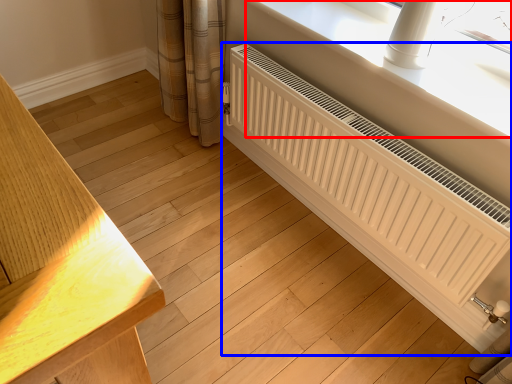
Question: Among these objects, which one is farthest to the camera, window sill (highlighted by a red box) or radiator (highlighted by a blue box)?

Choices:
 (A) window sill
 (B) radiator

Answer: (A)